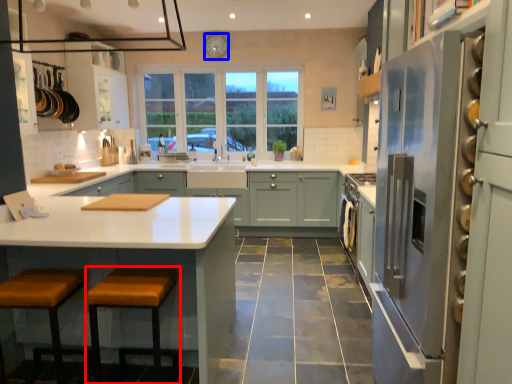
Question: Among these objects, which one is nearest to the camera, stool (highlighted by a red box) or clock (highlighted by a blue box)?

Choices:
 (A) stool
 (B) clock

Answer: (A)